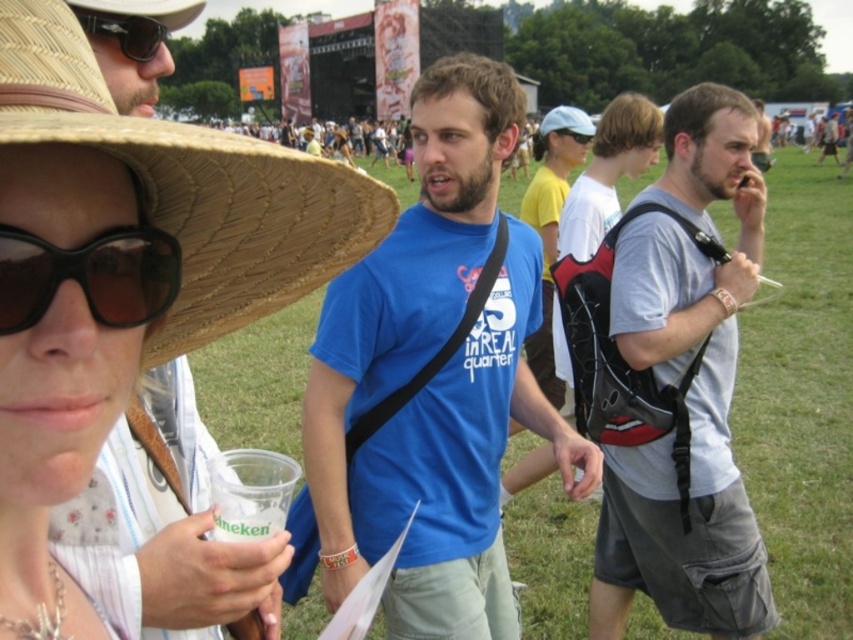
Between black matte goggles at center and clear plastic cup at center, which one has more height?

black matte goggles at center is taller.

Which is below, black matte goggles at center or clear plastic cup at center?

clear plastic cup at center is lower down.

Is point (94, 250) behind point (230, 522)?

No, it is in front of (230, 522).

Image resolution: width=853 pixels, height=640 pixels. What are the coordinates of `black matte goggles at center` in the screenshot? It's located at (90, 276).

Who is more forward, (646,556) or (332,234)?

Point (332,234) is in front.

Does gray fabric backpack at right have a larger size compared to brown straw cowboy hat at upper left?

Indeed, gray fabric backpack at right has a larger size compared to brown straw cowboy hat at upper left.

Who is more distant from viewer, (670,349) or (71,128)?

The point (670,349) is more distant.

Find the location of a particular element. The height and width of the screenshot is (640, 853). gray fabric backpack at right is located at coordinates (688, 388).

Can you confirm if gray fabric backpack at right is positioned to the right of matte black goggles at upper center?

Indeed, gray fabric backpack at right is positioned on the right side of matte black goggles at upper center.

Is gray fabric backpack at right positioned in front of matte black goggles at upper center?

That is True.

Between point (751, 248) and point (577, 136), which one is positioned behind?

Point (577, 136)

The width and height of the screenshot is (853, 640). In order to click on gray fabric backpack at right in this screenshot , I will do `click(688, 388)`.